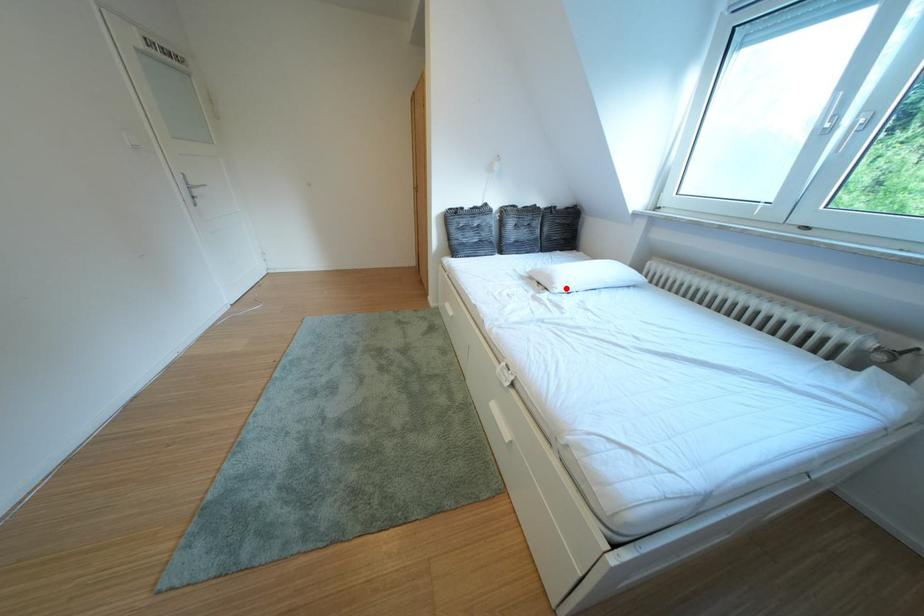
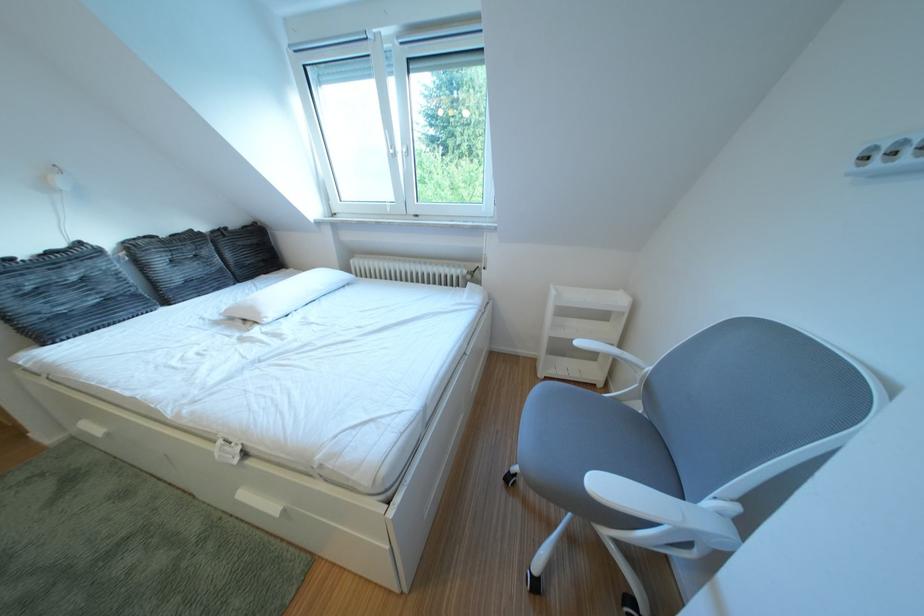
In the second image, find the point that corresponds to the highlighted location in the first image.

(273, 318)